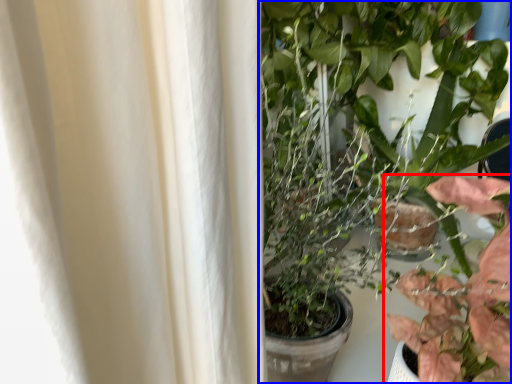
Question: Which object is further to the camera taking this photo, houseplant (highlighted by a red box) or houseplant (highlighted by a blue box)?

Choices:
 (A) houseplant
 (B) houseplant

Answer: (B)